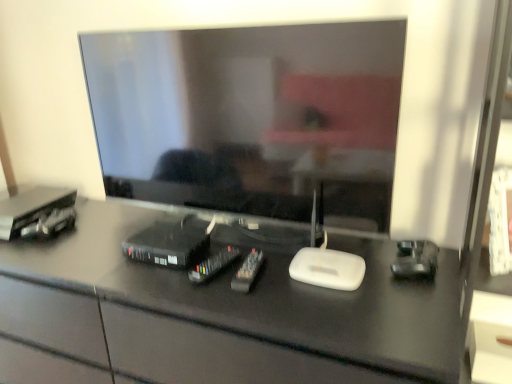
You are a GUI agent. You are given a task and a screenshot of the screen. Output one action in this format:
    pyautogui.click(x=<x>, y=<y>)
    Task: Click on the vacant area to the left of black plastic remote controls at center, the 1th equipment when ordered from right to left
    This screenshot has height=384, width=512.
    Given the screenshot: What is the action you would take?
    pyautogui.click(x=191, y=284)